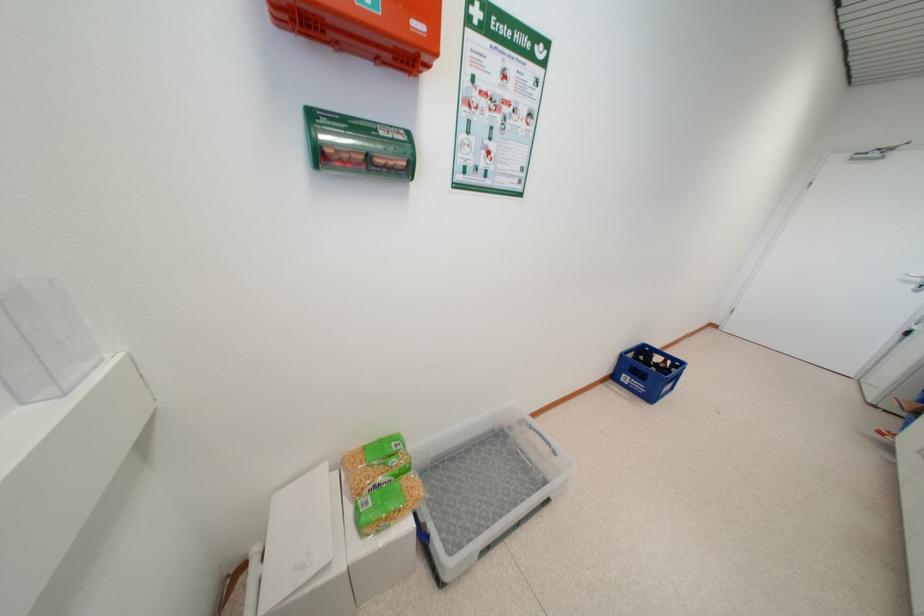
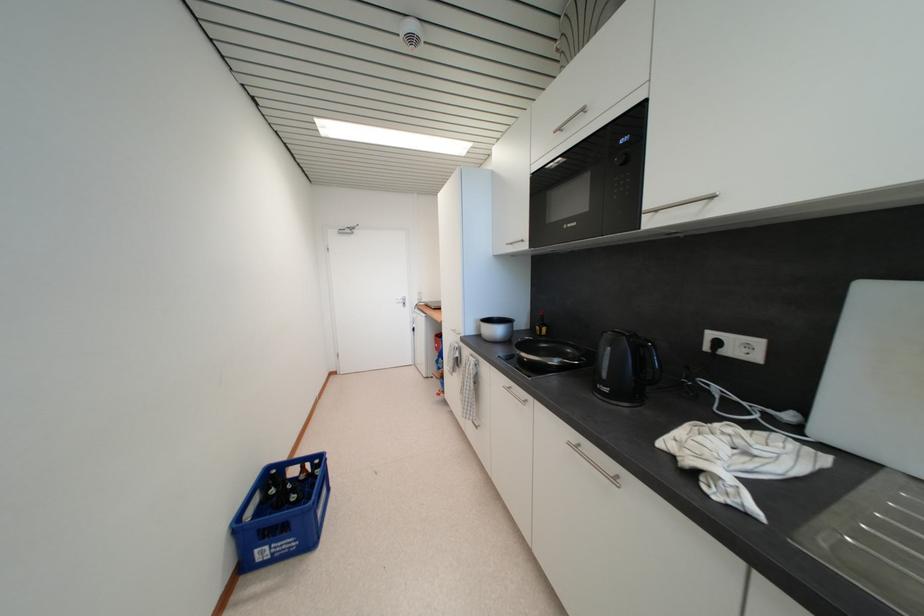
Question: The camera is either moving clockwise (left) or counter-clockwise (right) around the object. The first image is from the beginning of the video and the second image is from the end. Is the camera moving left or right when shooting the video?

Choices:
 (A) Left
 (B) Right

Answer: (A)